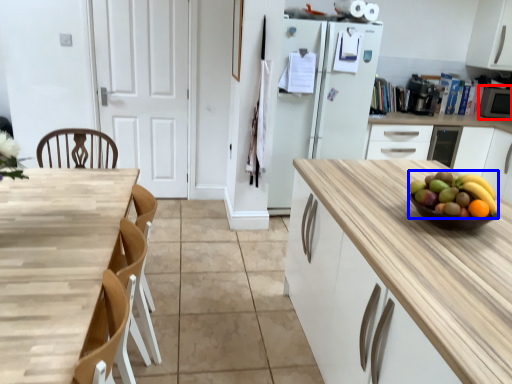
Question: Which point is closer to the camera, appliance (highlighted by a red box) or grapefruit (highlighted by a blue box)?

Choices:
 (A) appliance
 (B) grapefruit

Answer: (B)